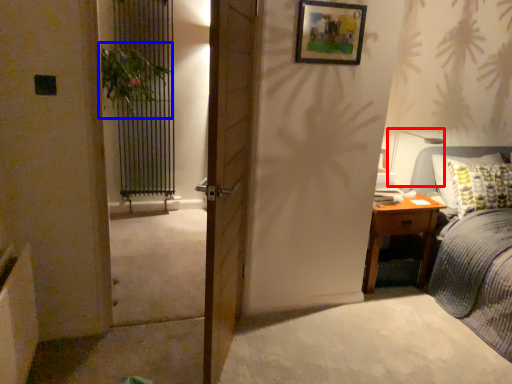
Question: Which object appears closest to the camera in this image, table lamp (highlighted by a red box) or plant (highlighted by a blue box)?

Choices:
 (A) table lamp
 (B) plant

Answer: (B)